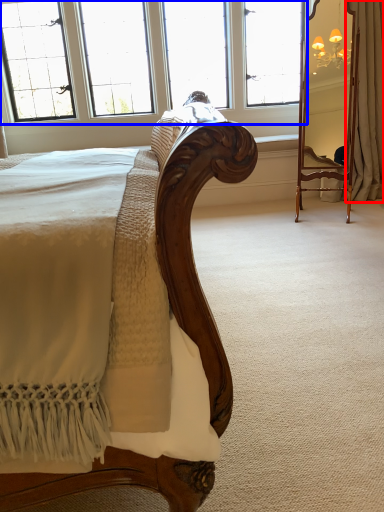
Question: Which point is closer to the camera, curtain (highlighted by a red box) or window (highlighted by a blue box)?

Choices:
 (A) curtain
 (B) window

Answer: (A)